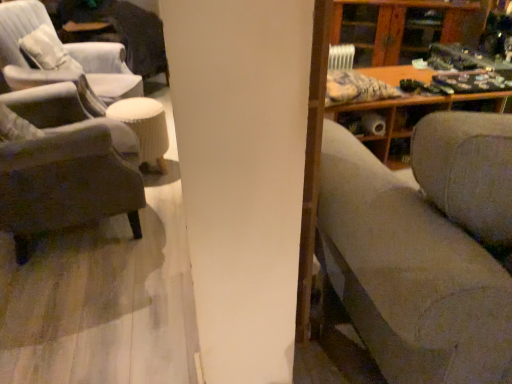
The height and width of the screenshot is (384, 512). I want to click on textured gray couch at right, so click(424, 248).

What is the approximate width of velvet gray armchair at left, which is the 2th chair in back-to-front order?

The width of velvet gray armchair at left, which is the 2th chair in back-to-front order, is 30.79 inches.

What are the coordinates of `white ribbed stool at center` in the screenshot? It's located at (145, 127).

Image resolution: width=512 pixels, height=384 pixels. I want to click on wooden cabinet at upper right, so 404,27.

You are a GUI agent. You are given a task and a screenshot of the screen. Output one action in this format:
    pyautogui.click(x=<x>, y=<y>)
    Task: Click on the textured gray couch at right
    The height and width of the screenshot is (384, 512).
    Given the screenshot: What is the action you would take?
    click(x=424, y=248)

Looking at their sizes, would you say matte gray chair at left, which ranks as the 2th chair in front-to-back order, is wider or thinner than white ribbed stool at center?

In the image, matte gray chair at left, which ranks as the 2th chair in front-to-back order, appears to be wider than white ribbed stool at center.

Is point (21, 68) farther from viewer compared to point (162, 105)?

That is False.

Considering their positions, is matte gray chair at left, which is the 1th chair in back-to-front order, located in front of or behind white ribbed stool at center?

matte gray chair at left, which is the 1th chair in back-to-front order, is positioned closer to the viewer than white ribbed stool at center.

Is the position of wooden cabinet at upper right less distant than that of velvet gray armchair at left, which is the 2th chair in back-to-front order?

No, wooden cabinet at upper right is further to the viewer.

Find the location of a particular element. chair that is the 2nd object located below the wooden cabinet at upper right (from the image's perspective) is located at coordinates (65, 169).

Is there a large distance between wooden cabinet at upper right and velvet gray armchair at left, which is the 2th chair in back-to-front order?

Indeed, wooden cabinet at upper right is not near velvet gray armchair at left, which is the 2th chair in back-to-front order.

Would you say wooden cabinet at upper right is inside or outside velvet gray armchair at left, placed as the 1th chair when sorted from front to back?

wooden cabinet at upper right cannot be found inside velvet gray armchair at left, placed as the 1th chair when sorted from front to back.

Which point is more forward, (421, 190) or (100, 64)?

Positioned in front is point (421, 190).

Is textured gray couch at right closer to camera compared to matte gray chair at left, which ranks as the 2th chair in front-to-back order?

Yes, textured gray couch at right is closer to the viewer.

From a real-world perspective, is textured gray couch at right under matte gray chair at left, which ranks as the 2th chair in front-to-back order?

Yes, from a real-world perspective, textured gray couch at right is under matte gray chair at left, which ranks as the 2th chair in front-to-back order.

This screenshot has height=384, width=512. In order to click on the 1st chair positioned above the textured gray couch at right (from a real-world perspective) in this screenshot , I will do `click(18, 40)`.

From a real-world perspective, between white ribbed stool at center and matte gray chair at left, which is the 1th chair in back-to-front order, who is vertically higher?

From a 3D spatial view, matte gray chair at left, which is the 1th chair in back-to-front order, is above.

Is white ribbed stool at center not near matte gray chair at left, which is the 1th chair in back-to-front order?

white ribbed stool at center is actually quite close to matte gray chair at left, which is the 1th chair in back-to-front order.

Is point (156, 164) positioned in front of point (31, 19)?

Yes, it is.

Would you say white ribbed stool at center contains matte gray chair at left, which ranks as the 2th chair in front-to-back order?

No, matte gray chair at left, which ranks as the 2th chair in front-to-back order, is located outside of white ribbed stool at center.

Is textured gray couch at right taller than wooden cabinet at upper right?

Yes.

From a real-world perspective, is textured gray couch at right positioned over wooden cabinet at upper right based on gravity?

Yes.

Which is in front, textured gray couch at right or wooden cabinet at upper right?

textured gray couch at right.

Does textured gray couch at right have a smaller size compared to wooden cabinet at upper right?

Actually, textured gray couch at right might be larger than wooden cabinet at upper right.

Is velvet gray armchair at left, placed as the 1th chair when sorted from front to back, facing away from white ribbed stool at center?

Result: No, velvet gray armchair at left, placed as the 1th chair when sorted from front to back, is not facing away from white ribbed stool at center.

There is a white ribbed stool at center. Identify the location of the 2nd chair above it (from a real-world perspective). This screenshot has width=512, height=384. (65, 169).

Considering the sizes of objects velvet gray armchair at left, placed as the 1th chair when sorted from front to back, and white ribbed stool at center in the image provided, who is bigger, velvet gray armchair at left, placed as the 1th chair when sorted from front to back, or white ribbed stool at center?

With larger size is velvet gray armchair at left, placed as the 1th chair when sorted from front to back.

From the image's perspective, is velvet gray armchair at left, which is the 2th chair in back-to-front order, below white ribbed stool at center?

Correct, velvet gray armchair at left, which is the 2th chair in back-to-front order, appears lower than white ribbed stool at center in the image.

Which is more distant, (5, 48) or (348, 4)?

The point (348, 4) is more distant.

Identify the location of shelf behind the matte gray chair at left, which ranks as the 2th chair in front-to-back order. (404, 27).

What's the angular difference between matte gray chair at left, which ranks as the 2th chair in front-to-back order, and wooden cabinet at upper right's facing directions?

The angle between the facing direction of matte gray chair at left, which ranks as the 2th chair in front-to-back order, and the facing direction of wooden cabinet at upper right is 104 degrees.

Considering the sizes of objects matte gray chair at left, which ranks as the 2th chair in front-to-back order, and wooden cabinet at upper right in the image provided, who is bigger, matte gray chair at left, which ranks as the 2th chair in front-to-back order, or wooden cabinet at upper right?

matte gray chair at left, which ranks as the 2th chair in front-to-back order.

Identify the location of stool behind the matte gray chair at left, which ranks as the 2th chair in front-to-back order. (145, 127).

Identify the location of the 1st chair to the left of the wooden cabinet at upper right, counting from the anchor's position. This screenshot has height=384, width=512. (65, 169).

From the picture: From the image, which object appears to be nearer to velvet gray armchair at left, which is the 2th chair in back-to-front order, matte gray chair at left, which is the 1th chair in back-to-front order, or white ribbed stool at center?

white ribbed stool at center is closer to velvet gray armchair at left, which is the 2th chair in back-to-front order.

When comparing their distances from wooden cabinet at upper right, does textured gray couch at right or velvet gray armchair at left, placed as the 1th chair when sorted from front to back, seem further?

Among the two, textured gray couch at right is located further to wooden cabinet at upper right.

Which object lies further to the anchor point velvet gray armchair at left, placed as the 1th chair when sorted from front to back, wooden cabinet at upper right or white ribbed stool at center?

wooden cabinet at upper right is positioned further to the anchor velvet gray armchair at left, placed as the 1th chair when sorted from front to back.

Looking at the image, which one is located further to matte gray chair at left, which is the 1th chair in back-to-front order, textured gray couch at right or white ribbed stool at center?

Based on the image, textured gray couch at right appears to be further to matte gray chair at left, which is the 1th chair in back-to-front order.

From the image, which object appears to be farther from textured gray couch at right, wooden cabinet at upper right or matte gray chair at left, which is the 1th chair in back-to-front order?

Based on the image, wooden cabinet at upper right appears to be further to textured gray couch at right.

When comparing their distances from white ribbed stool at center, does textured gray couch at right or matte gray chair at left, which is the 1th chair in back-to-front order, seem further?

Among the two, textured gray couch at right is located further to white ribbed stool at center.

Based on the photo, based on their spatial positions, is velvet gray armchair at left, placed as the 1th chair when sorted from front to back, or matte gray chair at left, which is the 1th chair in back-to-front order, closer to wooden cabinet at upper right?

matte gray chair at left, which is the 1th chair in back-to-front order, is positioned closer to the anchor wooden cabinet at upper right.

Considering their positions, is white ribbed stool at center positioned further to wooden cabinet at upper right than matte gray chair at left, which ranks as the 2th chair in front-to-back order?

white ribbed stool at center lies further to wooden cabinet at upper right than the other object.

You are a GUI agent. You are given a task and a screenshot of the screen. Output one action in this format:
    pyautogui.click(x=<x>, y=<y>)
    Task: Click on the chair located between velvet gray armchair at left, which is the 2th chair in back-to-front order, and white ribbed stool at center in the depth direction
    The image size is (512, 384).
    Given the screenshot: What is the action you would take?
    pyautogui.click(x=18, y=40)

Identify the location of stool between velvet gray armchair at left, placed as the 1th chair when sorted from front to back, and textured gray couch at right from left to right. The image size is (512, 384). (145, 127).

Where is `stool situated between matte gray chair at left, which is the 1th chair in back-to-front order, and textured gray couch at right from left to right`? This screenshot has width=512, height=384. stool situated between matte gray chair at left, which is the 1th chair in back-to-front order, and textured gray couch at right from left to right is located at coordinates (145, 127).

Identify the location of chair located between matte gray chair at left, which ranks as the 2th chair in front-to-back order, and textured gray couch at right in the left-right direction. (65, 169).